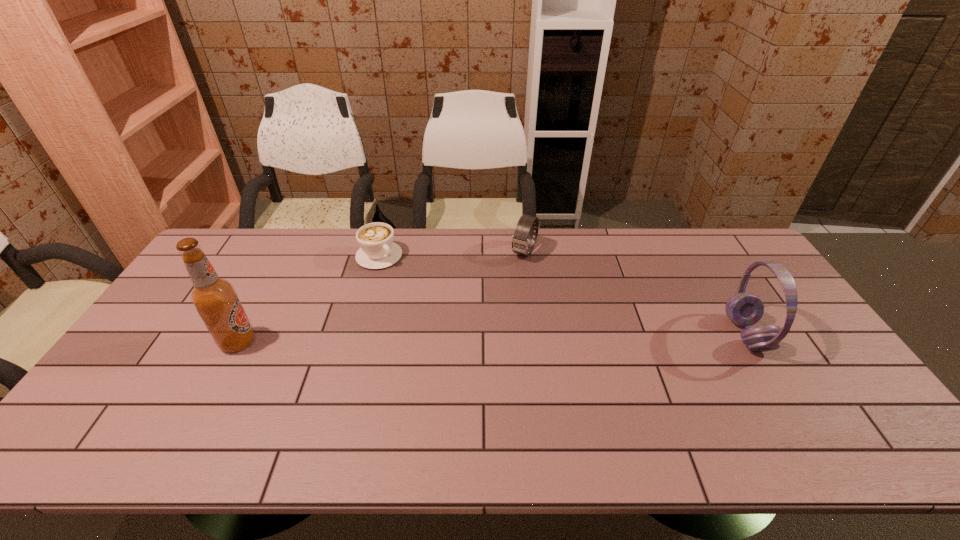
In order to click on vacant space on the desktop that is between the tallest object and the rightmost object and is positioned to the right of the shortest object's handle in this screenshot , I will do `click(475, 339)`.

Locate an element on the screen. The image size is (960, 540). vacant spot on the desktop that is between the tallest object and the rightmost object and is positioned on the face of the second shortest object is located at coordinates (472, 339).